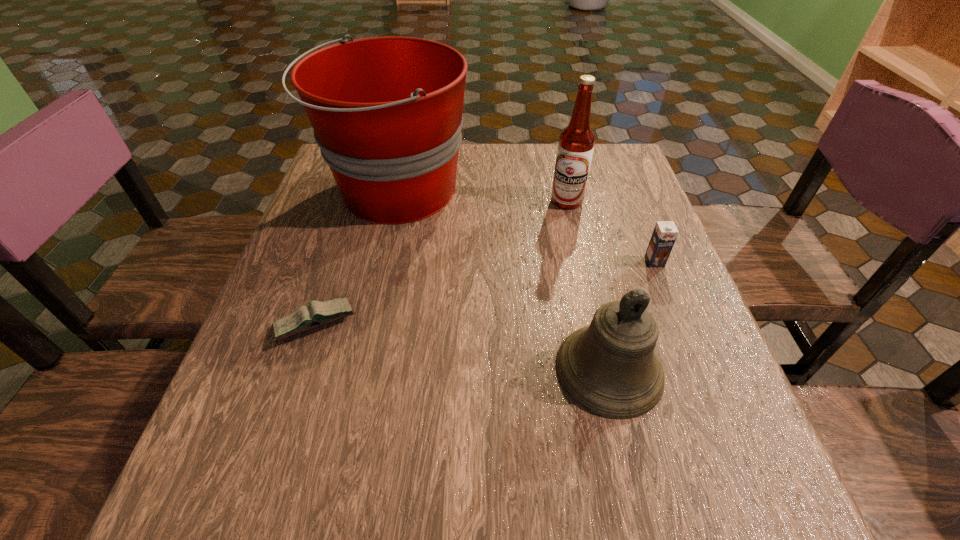
Find the location of a particular element. free spot between the alcohol and the bucket is located at coordinates (481, 196).

This screenshot has width=960, height=540. Identify the location of free space between the third shortest object and the bucket. (502, 280).

The image size is (960, 540). Identify the location of empty location between the bell and the shortest object. (463, 347).

Where is `free spot between the shortest object and the alcohol`? The image size is (960, 540). free spot between the shortest object and the alcohol is located at coordinates (442, 262).

You are a GUI agent. You are given a task and a screenshot of the screen. Output one action in this format:
    pyautogui.click(x=<x>, y=<y>)
    Task: Click on the closest object to the second shortest object
    This screenshot has width=960, height=540.
    Given the screenshot: What is the action you would take?
    pyautogui.click(x=610, y=367)

Identify which object is the closest to the bucket. Please provide its 2D coordinates. Your answer should be formatted as a tuple, i.e. [(x, y)], where the tuple contains the x and y coordinates of a point satisfying the conditions above.

[(304, 318)]

Image resolution: width=960 pixels, height=540 pixels. I want to click on free point that satisfies the following two spatial constraints: 1. on the label side of the alcohol; 2. on the right side of the third shortest object, so click(606, 369).

Locate an element on the screen. This screenshot has height=540, width=960. free space that satisfies the following two spatial constraints: 1. on the front side of the shortest object; 2. on the right side of the third tallest object is located at coordinates (300, 369).

Identify the location of free location that satisfies the following two spatial constraints: 1. on the label side of the alcohol; 2. on the left side of the third tallest object. The image size is (960, 540). (606, 369).

The width and height of the screenshot is (960, 540). Find the location of `blank area in the image that satisfies the following two spatial constraints: 1. on the label side of the bell; 2. on the right side of the alcohol`. blank area in the image that satisfies the following two spatial constraints: 1. on the label side of the bell; 2. on the right side of the alcohol is located at coordinates tap(606, 369).